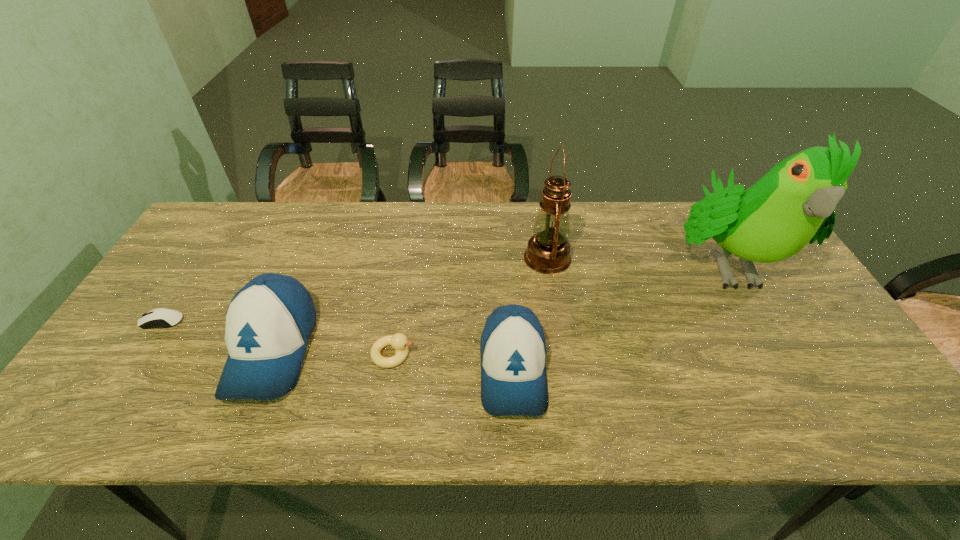
Where is `duckling`? The image size is (960, 540). duckling is located at coordinates (398, 341).

Where is `vacant area situated 0.160m on the beak of the tallest object`? The width and height of the screenshot is (960, 540). vacant area situated 0.160m on the beak of the tallest object is located at coordinates (788, 373).

Identify the location of free space located on the right of the oil lamp. Image resolution: width=960 pixels, height=540 pixels. (684, 258).

The height and width of the screenshot is (540, 960). What are the coordinates of `vacant point located 0.170m on the front of the leftmost object` in the screenshot? It's located at (118, 389).

This screenshot has width=960, height=540. In order to click on free region located at the beak of the fifth tallest object in this screenshot , I will do `click(476, 354)`.

Locate an element on the screen. parakeet that is positioned at the far edge is located at coordinates (794, 203).

Where is `oil lamp at the far edge`? The width and height of the screenshot is (960, 540). oil lamp at the far edge is located at coordinates (548, 251).

Where is `duckling that is at the near edge`? duckling that is at the near edge is located at coordinates (398, 341).

Where is `object present at the left edge`? The height and width of the screenshot is (540, 960). object present at the left edge is located at coordinates (161, 317).

Find the location of a particular element. Image resolution: width=960 pixels, height=540 pixels. object present at the right edge is located at coordinates (794, 203).